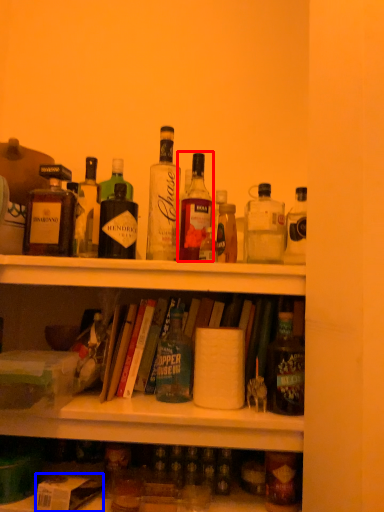
Question: Which of the following is the closest to the observer, bottle (highlighted by a red box) or box (highlighted by a blue box)?

Choices:
 (A) bottle
 (B) box

Answer: (B)